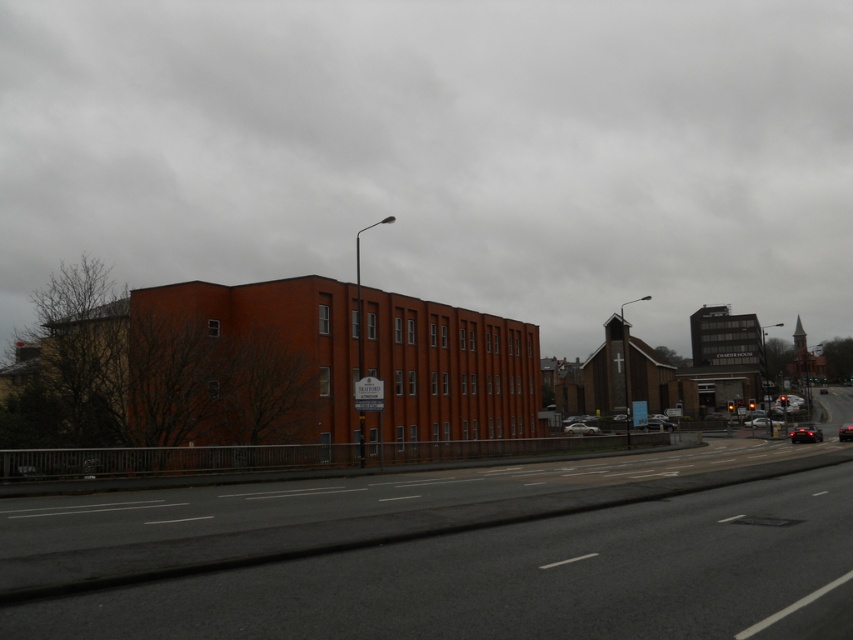
Question: Does shiny black car at right appear on the right side of metallic silver car at center?

Choices:
 (A) yes
 (B) no

Answer: (A)

Question: Does shiny black car at right come in front of metallic silver car at center?

Choices:
 (A) no
 (B) yes

Answer: (B)

Question: Which of the following is the farthest from the observer?

Choices:
 (A) metallic silver car at center
 (B) black glossy car at center
 (C) silver metallic sedan at center
 (D) shiny black car at right

Answer: (A)

Question: Which object is closer to the camera taking this photo?

Choices:
 (A) silver metallic sedan at center
 (B) metallic silver car at center-right

Answer: (A)

Question: Which of these objects is positioned farthest from the shiny black car at right?

Choices:
 (A) black glossy car at center
 (B) silver metallic sedan at center

Answer: (B)

Question: Observing the image, what is the correct spatial positioning of silver metallic sedan at center in reference to black glossy car at center?

Choices:
 (A) below
 (B) above

Answer: (A)